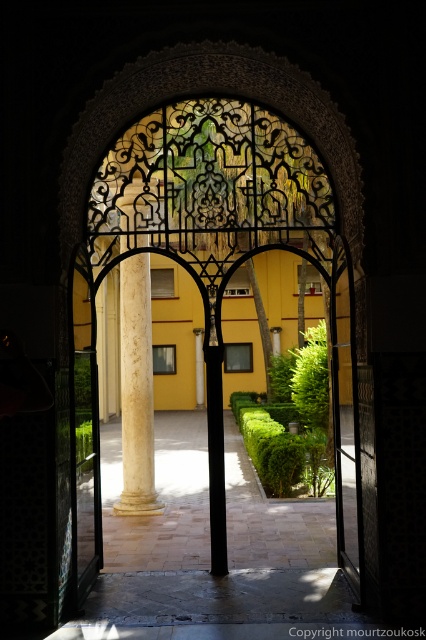
You are a tour guide leading a group through the courtyard. You need to walk from the paved stone path at center to the black metal gate at center. How far will you have to walk?

The distance between the paved stone path at center and the black metal gate at center is 6.34 meters, so you will have to walk 6.34 meters.

You are a visitor standing in front of the courtyard entrance. You notice the black glass door at center and the white marble column at center. Which object appears smaller in size?

The black glass door at center appears smaller in size compared to the white marble column at center.